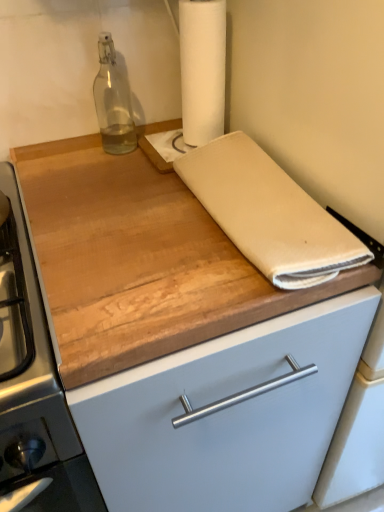
Question: Which is correct: transparent glass bottle at upper left is inside white paper towel at upper center, or outside of it?

Choices:
 (A) outside
 (B) inside

Answer: (A)

Question: Is point (110, 97) positioned closer to the camera than point (225, 55)?

Choices:
 (A) farther
 (B) closer

Answer: (A)

Question: Estimate the real-world distances between objects in this image. Which object is closer to the wooden cutting board at center?

Choices:
 (A) beige cotton towel at center
 (B) white paper towel at upper center
 (C) transparent glass bottle at upper left

Answer: (A)

Question: Estimate the real-world distances between objects in this image. Which object is closer to the transparent glass bottle at upper left?

Choices:
 (A) wooden cutting board at center
 (B) beige cotton towel at center
 (C) white paper towel at upper center

Answer: (C)